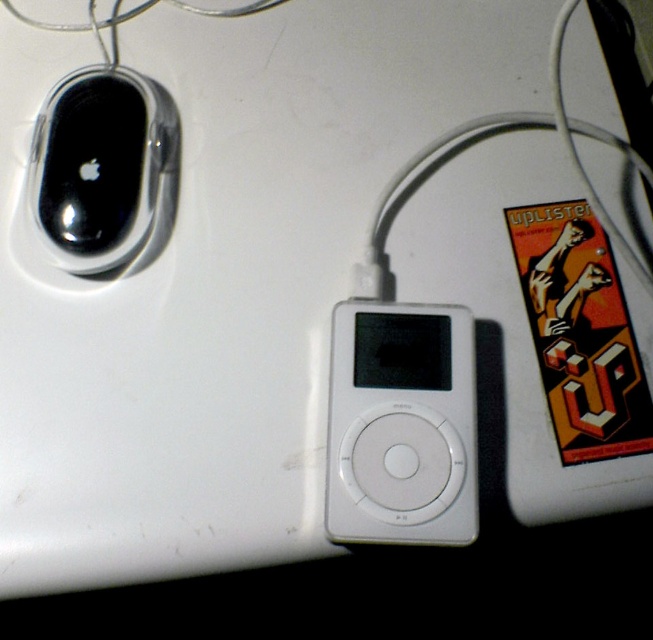
Question: Can you confirm if white matte/ipod at center is wider than sleek black mouse at upper left?

Choices:
 (A) no
 (B) yes

Answer: (A)

Question: Does white matte/ipod at center have a smaller size compared to sleek black mouse at upper left?

Choices:
 (A) no
 (B) yes

Answer: (B)

Question: Among these objects, which one is nearest to the camera?

Choices:
 (A) white matte/ipod at center
 (B) sleek black mouse at upper left

Answer: (A)

Question: Is white matte/ipod at center wider than sleek black mouse at upper left?

Choices:
 (A) no
 (B) yes

Answer: (A)